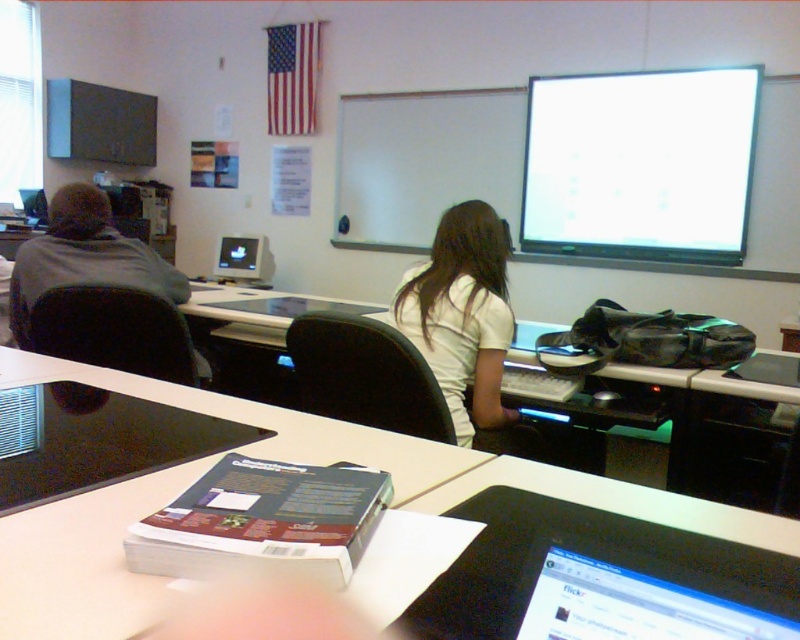
Who is higher up, white plastic computer desk at center or matte black monitor at center?

matte black monitor at center

Between white plastic computer desk at center and matte black monitor at center, which one appears on the right side from the viewer's perspective?

white plastic computer desk at center

At what (x,y) coordinates should I click in order to perform the action: click on white plastic computer desk at center. Please return your answer as a coordinate pair (x, y). Looking at the image, I should click on (416, 458).

Measure the distance between white plastic computer desk at center and camera.

They are 23.02 inches apart.

Between point (144, 508) and point (30, 200), which one is positioned behind?

The point (30, 200) is behind.

You are a GUI agent. You are given a task and a screenshot of the screen. Output one action in this format:
    pyautogui.click(x=<x>, y=<y>)
    Task: Click on the white plastic computer desk at center
    
    Given the screenshot: What is the action you would take?
    pyautogui.click(x=416, y=458)

Is white plastic computer desk at center to the right of gray fabric jacket at left from the viewer's perspective?

Indeed, white plastic computer desk at center is positioned on the right side of gray fabric jacket at left.

Is white plastic computer desk at center in front of gray fabric jacket at left?

That is True.

Is point (0, 625) farther from camera compared to point (62, 234)?

That is False.

The width and height of the screenshot is (800, 640). What are the coordinates of `white plastic computer desk at center` in the screenshot? It's located at (416, 458).